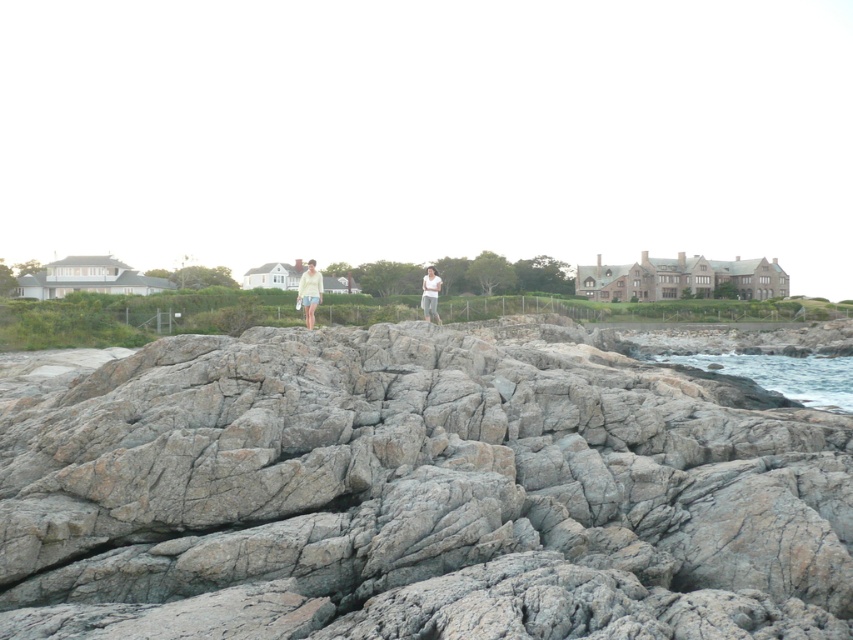
Question: Which point is farther from the camera taking this photo?

Choices:
 (A) (833, 385)
 (B) (421, 301)
 (C) (292, 429)

Answer: (A)

Question: Which of the following is the farthest from the observer?

Choices:
 (A) (769, 358)
 (B) (432, 310)
 (C) (306, 291)

Answer: (A)

Question: Does gray rough rock at center appear on the right side of white cotton shirt at center?

Choices:
 (A) no
 (B) yes

Answer: (A)

Question: In this image, where is gray rough rock at center located relative to light yellow fabric pants at center?

Choices:
 (A) below
 (B) above

Answer: (A)

Question: Which of the following is the closest to the observer?

Choices:
 (A) white cotton shirt at center
 (B) gray rough rock at center
 (C) light yellow fabric pants at center

Answer: (B)

Question: Does gray rough rock at center appear under blue water at lower right?

Choices:
 (A) no
 (B) yes

Answer: (A)